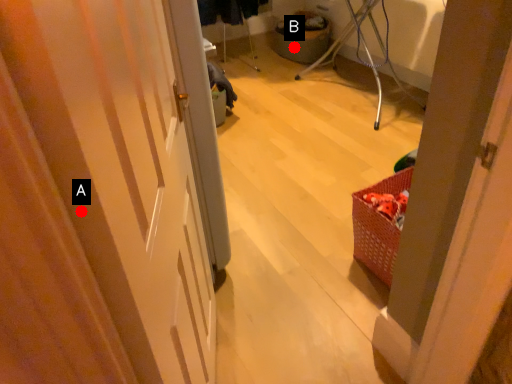
Question: Two points are circled on the image, labeled by A and B beside each circle. Which point is farther from the camera taking this photo?

Choices:
 (A) A is further
 (B) B is further

Answer: (B)